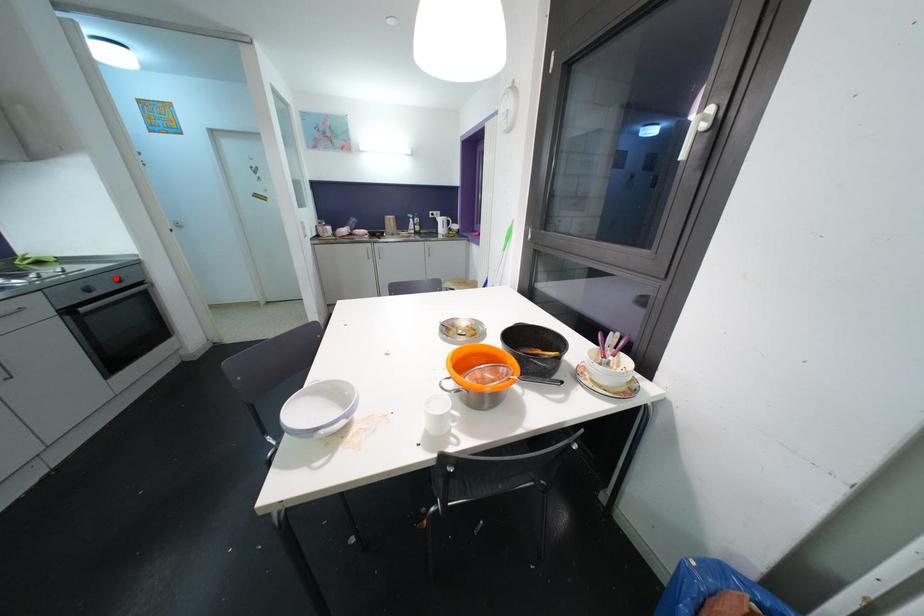
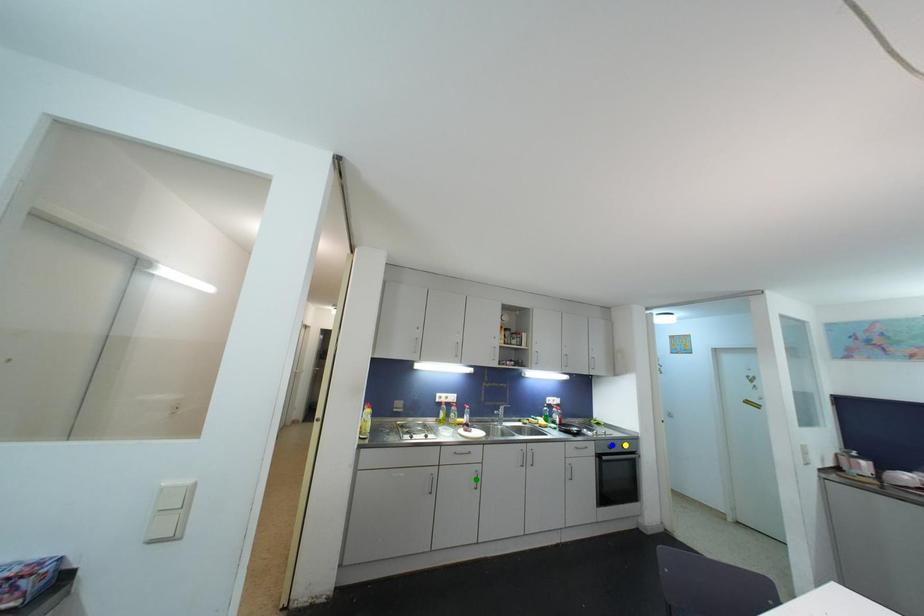
Question: I am providing you with two images of the same scene from different viewpoints. A red point is marked on the first image. You are given multiple points on the second image. In image 2, which mark is for the same physical point as the one in image 1?

Choices:
 (A) green point
 (B) blue point
 (C) yellow point

Answer: (C)